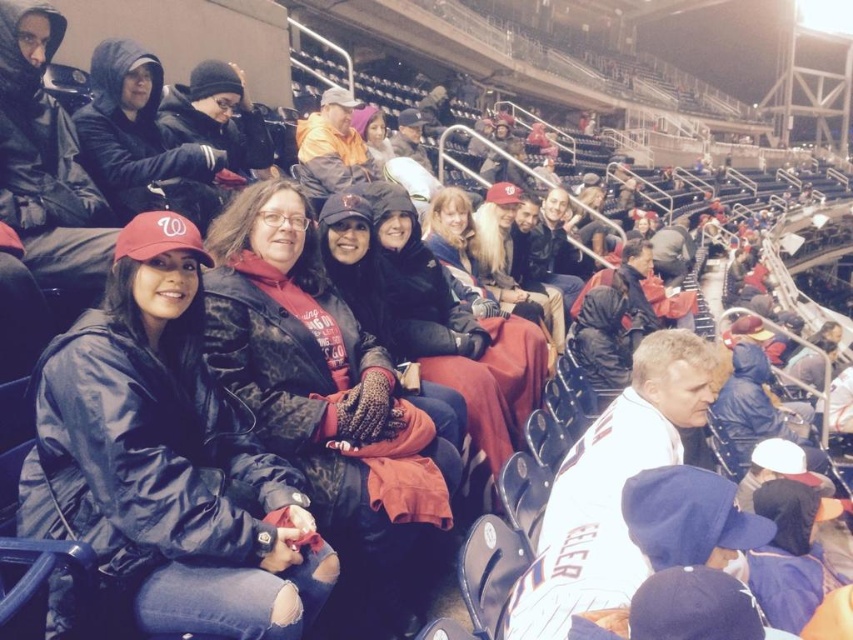
Question: Which object appears closest to the camera in this image?

Choices:
 (A) matte black jacket at upper left
 (B) matte black jacket at left

Answer: (B)

Question: Which object is farther from the camera taking this photo?

Choices:
 (A) matte black jacket at upper left
 (B) matte black jacket at left

Answer: (A)

Question: Considering the relative positions of matte black jacket at left and matte black jacket at upper left in the image provided, where is matte black jacket at left located with respect to matte black jacket at upper left?

Choices:
 (A) left
 (B) right

Answer: (B)

Question: Can you confirm if camouflage jacket at center is bigger than matte black jacket at upper left?

Choices:
 (A) yes
 (B) no

Answer: (A)

Question: Is matte black jacket at left positioned at the back of matte black jacket at upper left?

Choices:
 (A) yes
 (B) no

Answer: (B)

Question: Which point appears closest to the camera in this image?

Choices:
 (A) (132, 202)
 (B) (408, 531)

Answer: (B)